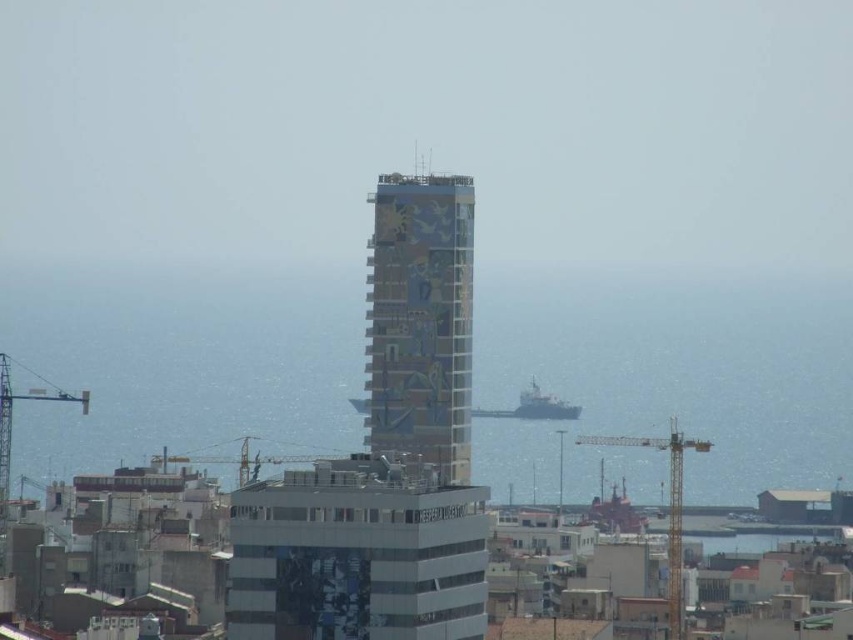
You are a city planner evaluating the city layout. You see the transparent glass water at center and the yellow metallic crane at lower right. Which object occupies a larger area in the scene?

The transparent glass water at center is bigger than the yellow metallic crane at lower right, so it occupies a larger area in the scene.

You are standing at the base of the skyscraper with the colorful mosaic facade. You notice a point marked at coordinates (666, 380). What is located at this point in the cityscape?

The point at coordinates (666, 380) corresponds to transparent glass water at center.